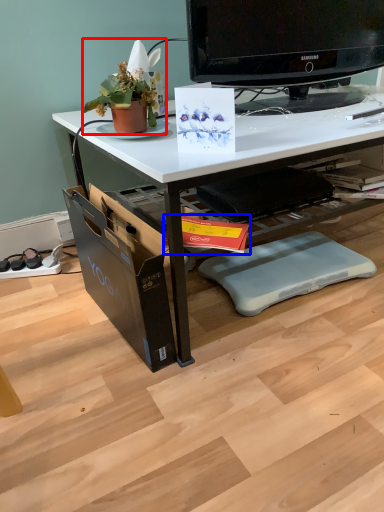
Question: Which object is closer to the camera taking this photo, houseplant (highlighted by a red box) or magazine (highlighted by a blue box)?

Choices:
 (A) houseplant
 (B) magazine

Answer: (B)